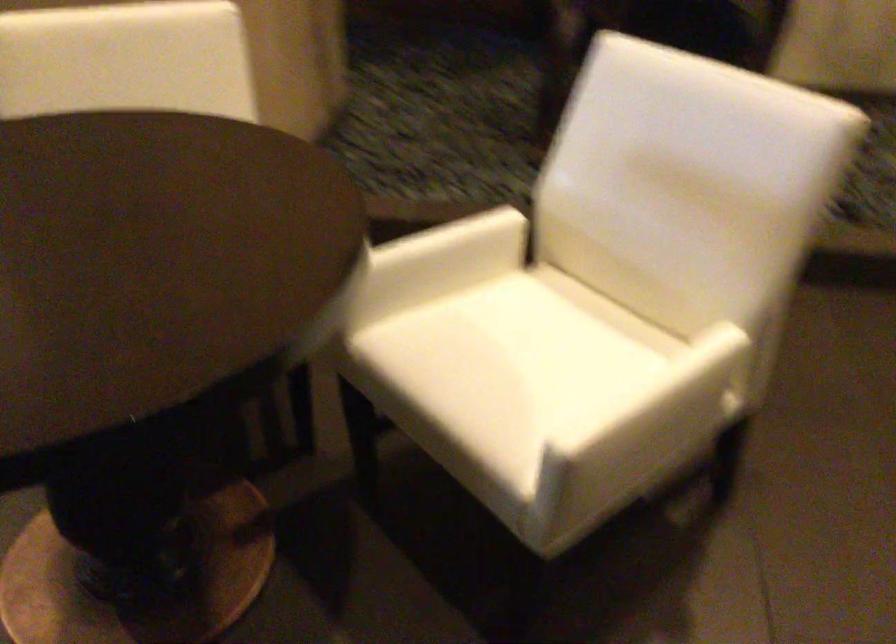
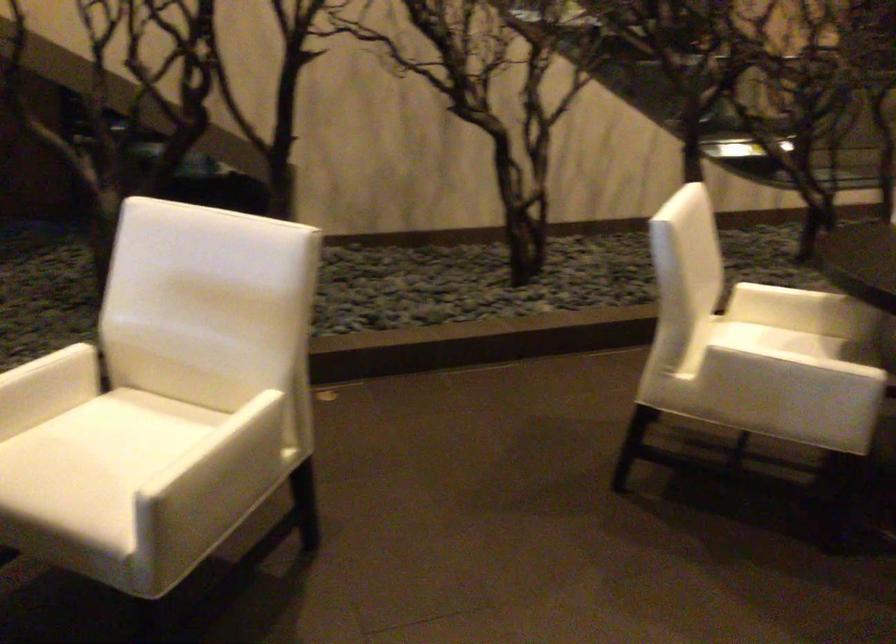
In the second image, find the point that corresponds to the point at 515,357 in the first image.

(105, 458)